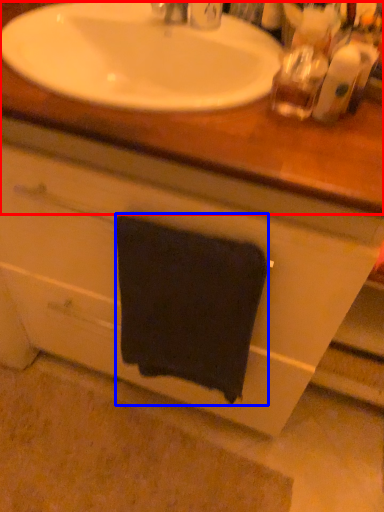
Question: Which object appears closest to the camera in this image, counter top (highlighted by a red box) or towel/napkin (highlighted by a blue box)?

Choices:
 (A) counter top
 (B) towel/napkin

Answer: (A)